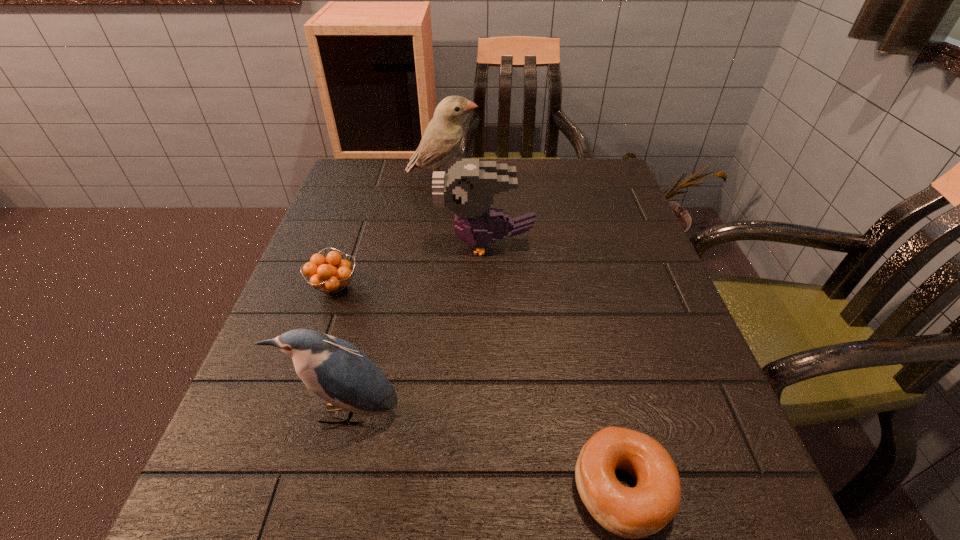
Image resolution: width=960 pixels, height=540 pixels. I want to click on vacant space that satisfies the following two spatial constraints: 1. at the beak of the second farthest object; 2. at the tip of the nearest bird's beak, so [x=488, y=413].

I want to click on vacant area in the image that satisfies the following two spatial constraints: 1. at the beak of the second nearest bird; 2. at the tip of the nearest bird's beak, so click(488, 413).

This screenshot has width=960, height=540. I want to click on free space that satisfies the following two spatial constraints: 1. at the face of the farthest bird; 2. on the front side of the third nearest object, so click(429, 286).